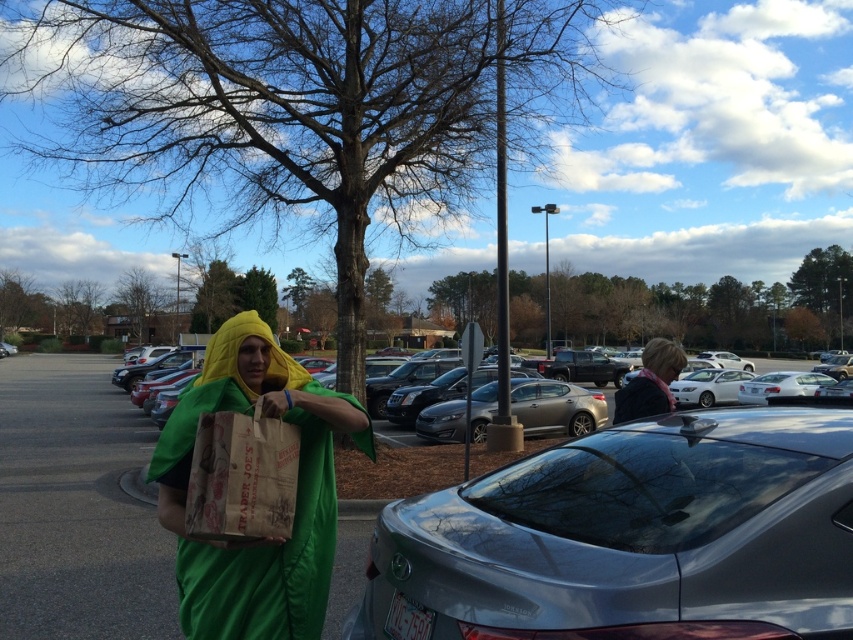
Who is positioned more to the right, metallic silver sedan at center or matte black jacket at upper right?

Positioned to the right is matte black jacket at upper right.

Who is positioned more to the left, metallic silver sedan at center or matte black jacket at upper right?

From the viewer's perspective, metallic silver sedan at center appears more on the left side.

The height and width of the screenshot is (640, 853). What do you see at coordinates (630, 538) in the screenshot? I see `metallic silver sedan at center` at bounding box center [630, 538].

The image size is (853, 640). I want to click on metallic silver sedan at center, so click(x=630, y=538).

How much distance is there between matte green costume at center and matte black jacket at upper right?

matte green costume at center is 3.13 meters away from matte black jacket at upper right.

Is matte green costume at center bigger than matte black jacket at upper right?

Actually, matte green costume at center might be smaller than matte black jacket at upper right.

Is point (160, 506) closer to camera compared to point (659, 390)?

That is True.

The width and height of the screenshot is (853, 640). What are the coordinates of `matte green costume at center` in the screenshot? It's located at (294, 492).

Can you confirm if metallic silver car at center is shorter than matte black jacket at upper right?

Yes.

Is metallic silver car at center thinner than matte black jacket at upper right?

In fact, metallic silver car at center might be wider than matte black jacket at upper right.

Find the location of a particular element. This screenshot has height=640, width=853. metallic silver car at center is located at coordinates (76, 508).